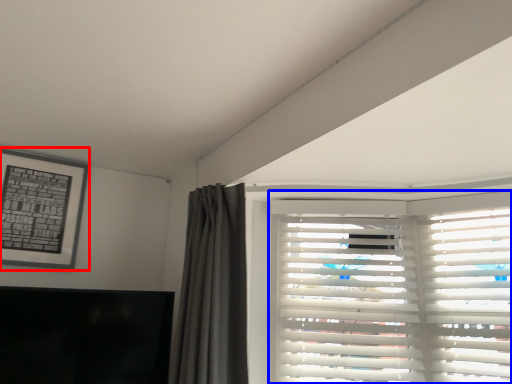
Question: Among these objects, which one is farthest to the camera, picture frame (highlighted by a red box) or window blind (highlighted by a blue box)?

Choices:
 (A) picture frame
 (B) window blind

Answer: (A)